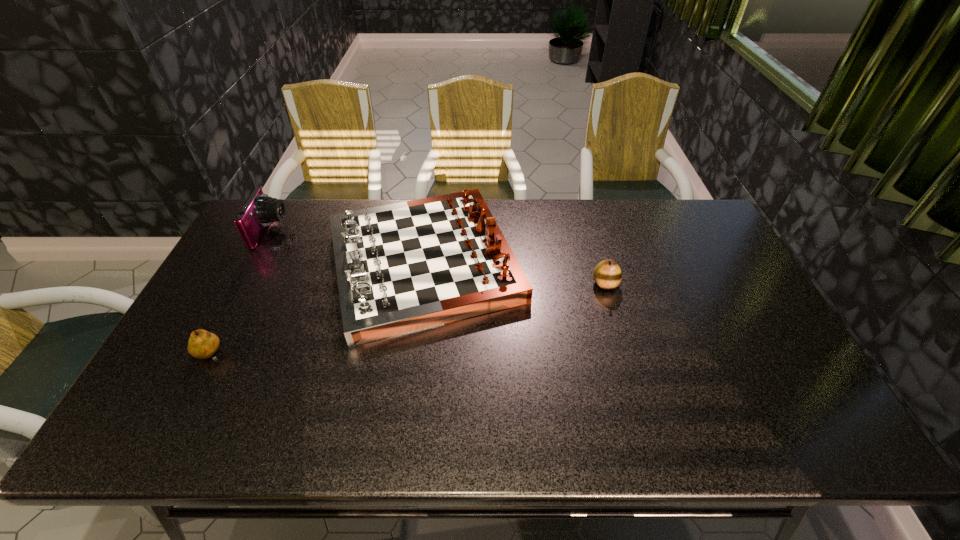
At what (x,y) coordinates should I click in order to perform the action: click on vacant position in the image that satisfies the following two spatial constraints: 1. on the front-facing side of the camera; 2. on the back side of the right pear. Please return your answer as a coordinate pair (x, y). This screenshot has height=540, width=960. Looking at the image, I should click on [x=243, y=284].

You are a GUI agent. You are given a task and a screenshot of the screen. Output one action in this format:
    pyautogui.click(x=<x>, y=<y>)
    Task: Click on the free point that satisfies the following two spatial constraints: 1. on the front-facing side of the camera; 2. on the back side of the third object from left to right
    
    Given the screenshot: What is the action you would take?
    pyautogui.click(x=254, y=263)

This screenshot has width=960, height=540. In order to click on blank space that satisfies the following two spatial constraints: 1. on the front-facing side of the left pear; 2. on the left side of the camera in this screenshot , I will do `click(205, 355)`.

At what (x,y) coordinates should I click in order to perform the action: click on vacant space that satisfies the following two spatial constraints: 1. on the back side of the shorter pear; 2. on the front-facing side of the camera. Please return your answer as a coordinate pair (x, y). Looking at the image, I should click on point(275,232).